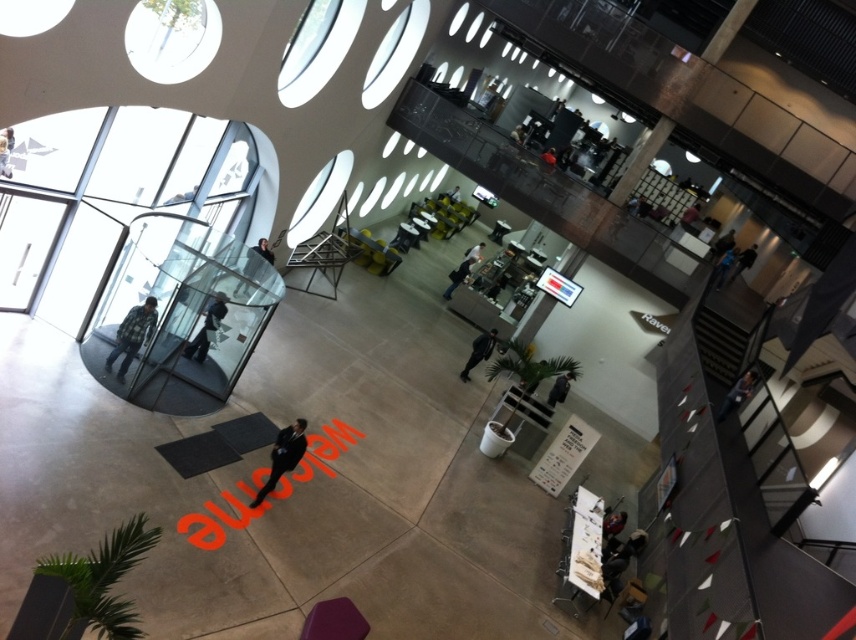
Question: Which is farther from the dark suit at center?

Choices:
 (A) black leather jacket at lower center
 (B) dark blue jeans at center
 (C) dark gray suit at center
 (D) dark blue jacket at upper right

Answer: (D)

Question: Is black leather jacket at lower center wider than black leather jacket at center?

Choices:
 (A) no
 (B) yes

Answer: (A)

Question: Which of the following is the closest to the observer?

Choices:
 (A) dark gray suit at center
 (B) black leather jacket at lower center
 (C) dark suit at center
 (D) matte black jacket at lower right

Answer: (C)

Question: Is dark suit at center below dark gray suit at center?

Choices:
 (A) no
 (B) yes

Answer: (B)

Question: From the image, what is the correct spatial relationship of dark suit at center in relation to black leather jacket at lower center?

Choices:
 (A) below
 (B) above

Answer: (A)

Question: Among these objects, which one is nearest to the camera?

Choices:
 (A) flannel shirt at left
 (B) dark gray suit at center

Answer: (A)